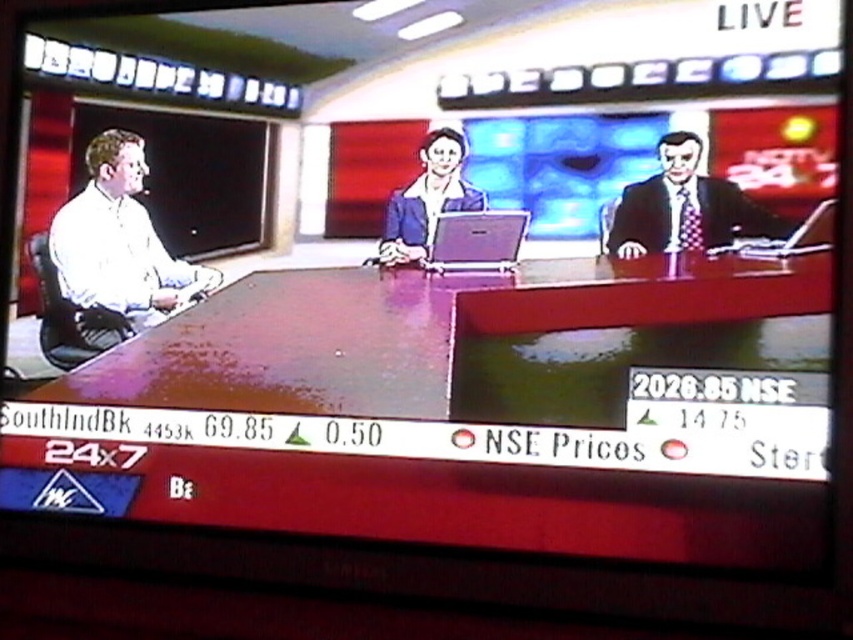
You are a camera operator adjusting the shot to focus on the matte blue blazer at center and the matte black laptop at right. Based on their positions, which object should you prioritize framing first to ensure both are visible in the shot?

The matte blue blazer at center is above the matte black laptop at right, so you should prioritize framing the matte blue blazer at center first to ensure both are visible in the shot.

You are a camera operator adjusting the camera angle to focus on the matte blue blazer at center and the matte black laptop at right. Which object should you position higher in the frame to ensure both are visible without cropping?

The matte blue blazer at center is taller than the matte black laptop at right, so you should position the matte blue blazer at center higher in the frame to accommodate its height and ensure both are visible without cropping.

You are a camera operator adjusting the camera angle to focus on the white glossy shirt at left and the matte black laptop at right. Which object should you position higher in the frame?

The white glossy shirt at left should be positioned higher in the frame since it is located above the matte black laptop at right.